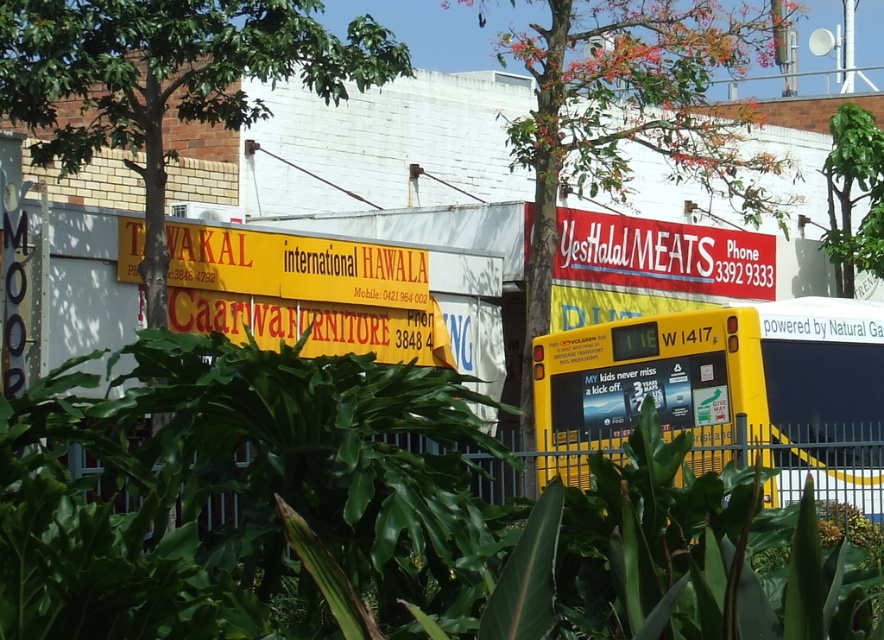
Question: Which point is closer to the camera?

Choices:
 (A) (852, 257)
 (B) (725, 28)
 (C) (852, 474)
 (D) (43, 531)

Answer: (D)

Question: Among these objects, which one is farthest from the camera?

Choices:
 (A) green leafy plants at center
 (B) green leafy tree at upper center
 (C) green leafy tree at upper left
 (D) yellow matte bus at center

Answer: (B)

Question: Does green leafy tree at upper left have a lesser width compared to green leafy tree at upper center?

Choices:
 (A) no
 (B) yes

Answer: (B)

Question: Does yellow matte bus at center lie in front of green leafy tree at upper left?

Choices:
 (A) no
 (B) yes

Answer: (A)

Question: Does yellow matte bus at center appear on the right side of green leafy tree at upper right?

Choices:
 (A) no
 (B) yes

Answer: (A)

Question: Estimate the real-world distances between objects in this image. Which object is farther from the yellow matte bus at center?

Choices:
 (A) green leafy tree at upper left
 (B) green leafy plants at center
 (C) green leafy tree at upper right
 (D) green leafy tree at upper center

Answer: (C)